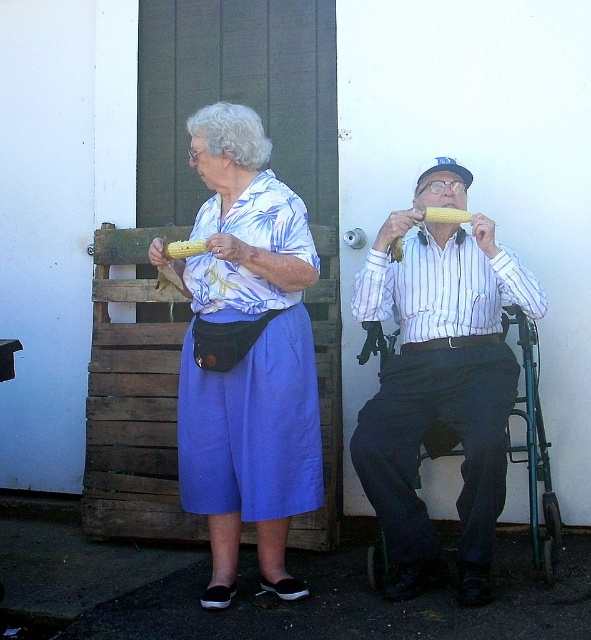
Can you confirm if matte blue skirt at center is shorter than yellow corn at upper center?

In fact, matte blue skirt at center may be taller than yellow corn at upper center.

Locate an element on the screen. Image resolution: width=591 pixels, height=640 pixels. matte blue skirt at center is located at coordinates (246, 355).

The image size is (591, 640). I want to click on matte blue skirt at center, so coord(246,355).

Can you confirm if matte blue skirt at center is wider than white striped shirt at center?

Incorrect, matte blue skirt at center's width does not surpass white striped shirt at center's.

Between matte blue skirt at center and white striped shirt at center, which one has less height?

With less height is white striped shirt at center.

Is point (228, 428) farther from camera compared to point (401, 448)?

Yes, it is.

Where is `matte blue skirt at center`? The width and height of the screenshot is (591, 640). matte blue skirt at center is located at coordinates 246,355.

Can you confirm if white striped shirt at center is positioned to the right of yellow corn at upper center?

No, white striped shirt at center is not to the right of yellow corn at upper center.

Image resolution: width=591 pixels, height=640 pixels. What do you see at coordinates (440, 380) in the screenshot?
I see `white striped shirt at center` at bounding box center [440, 380].

Is point (467, 524) farther from viewer compared to point (462, 211)?

No, it is not.

This screenshot has width=591, height=640. What are the coordinates of `white striped shirt at center` in the screenshot? It's located at (440, 380).